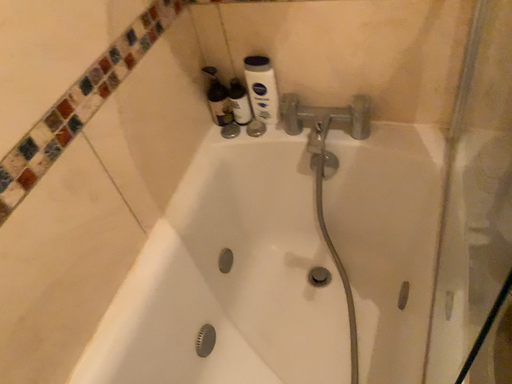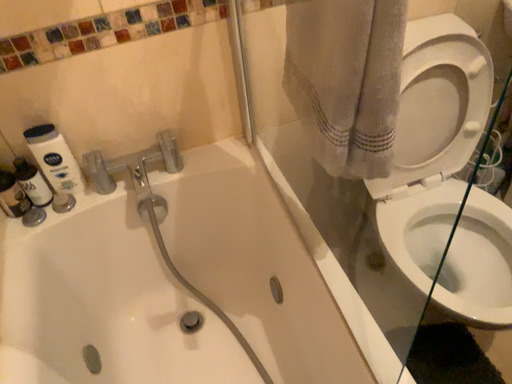
Question: How did the camera likely rotate when shooting the video?

Choices:
 (A) rotated left
 (B) rotated right

Answer: (B)